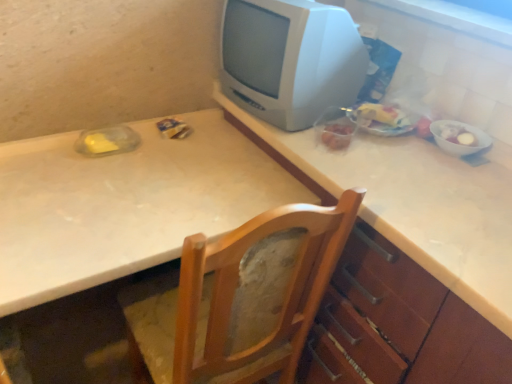
I want to click on free space in front of translucent plastic bag of food at right, positioned as the 2th food in right-to-left order, so click(x=392, y=157).